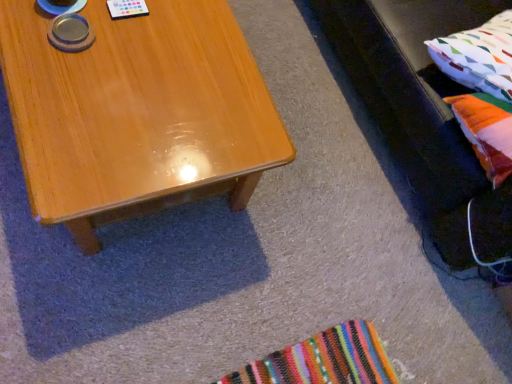
Question: Considering the relative sizes of velvet black couch at right and multicolored fabric pillow at right, the first pillow when ordered from bottom to top, in the image provided, is velvet black couch at right smaller than multicolored fabric pillow at right, the first pillow when ordered from bottom to top,?

Choices:
 (A) yes
 (B) no

Answer: (B)

Question: From the image's perspective, is velvet black couch at right on multicolored fabric pillow at right, placed as the 2th pillow when sorted from top to bottom?

Choices:
 (A) no
 (B) yes

Answer: (B)

Question: Can you confirm if velvet black couch at right is taller than multicolored fabric pillow at right, placed as the 2th pillow when sorted from top to bottom?

Choices:
 (A) yes
 (B) no

Answer: (A)

Question: Considering the relative sizes of velvet black couch at right and multicolored fabric pillow at right, placed as the 2th pillow when sorted from top to bottom, in the image provided, is velvet black couch at right shorter than multicolored fabric pillow at right, placed as the 2th pillow when sorted from top to bottom,?

Choices:
 (A) yes
 (B) no

Answer: (B)

Question: From the image's perspective, is velvet black couch at right beneath multicolored fabric pillow at right, the first pillow when ordered from bottom to top?

Choices:
 (A) no
 (B) yes

Answer: (A)

Question: Does velvet black couch at right come in front of multicolored fabric pillow at right, the first pillow when ordered from bottom to top?

Choices:
 (A) yes
 (B) no

Answer: (A)

Question: Considering the relative sizes of multicolored fabric pillow at right, placed as the 2th pillow when sorted from top to bottom, and velvet black couch at right in the image provided, is multicolored fabric pillow at right, placed as the 2th pillow when sorted from top to bottom, smaller than velvet black couch at right?

Choices:
 (A) no
 (B) yes

Answer: (B)

Question: Does multicolored fabric pillow at right, the first pillow when ordered from bottom to top, turn towards velvet black couch at right?

Choices:
 (A) no
 (B) yes

Answer: (B)

Question: Does multicolored fabric pillow at right, placed as the 2th pillow when sorted from top to bottom, have a lesser width compared to velvet black couch at right?

Choices:
 (A) yes
 (B) no

Answer: (A)

Question: From a real-world perspective, is multicolored fabric pillow at right, the first pillow when ordered from bottom to top, positioned under velvet black couch at right based on gravity?

Choices:
 (A) no
 (B) yes

Answer: (A)

Question: From a real-world perspective, is multicolored fabric pillow at right, placed as the 2th pillow when sorted from top to bottom, over velvet black couch at right?

Choices:
 (A) no
 (B) yes

Answer: (B)

Question: Does multicolored fabric pillow at right, the first pillow when ordered from bottom to top, have a greater width compared to velvet black couch at right?

Choices:
 (A) yes
 (B) no

Answer: (B)

Question: From the image's perspective, is multicolored fabric pillow at right, which is the second pillow in bottom-to-top order, below velvet black couch at right?

Choices:
 (A) no
 (B) yes

Answer: (B)